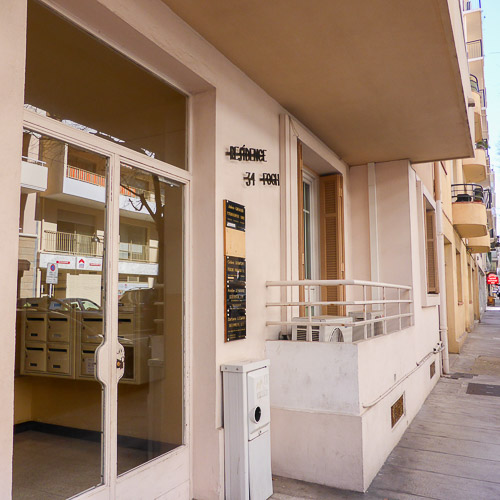
Find the location of a particular element. This screenshot has height=500, width=500. air conditioners is located at coordinates (327, 335), (374, 327).